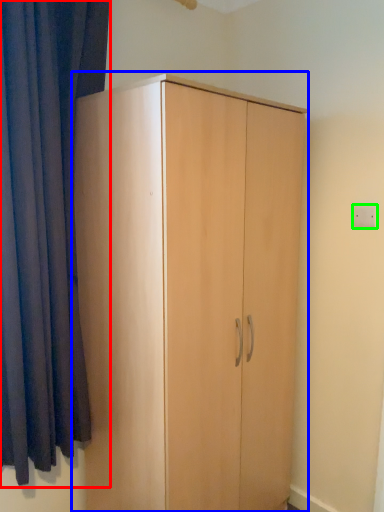
Question: Estimate the real-world distances between objects in this image. Which object is farther from curtain (highlighted by a red box), cupboard (highlighted by a blue box) or electric outlet (highlighted by a green box)?

Choices:
 (A) cupboard
 (B) electric outlet

Answer: (B)